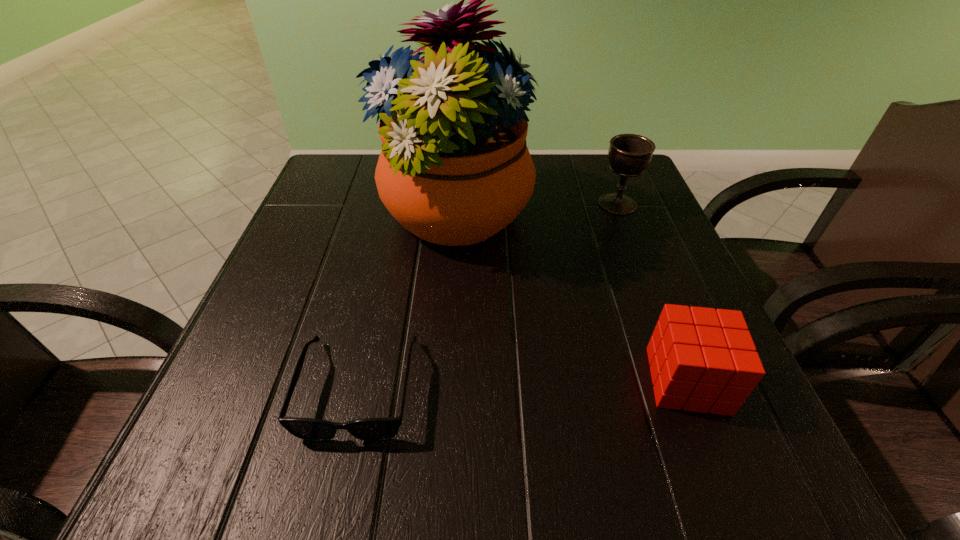
This screenshot has width=960, height=540. In order to click on free area in between the second shortest object and the chalice in this screenshot , I will do `click(652, 292)`.

Identify the location of vacant area that lies between the tallest object and the shortest object. (407, 303).

Where is `vacant area that lies between the third shortest object and the sunglasses`? The image size is (960, 540). vacant area that lies between the third shortest object and the sunglasses is located at coordinates (488, 296).

Locate an element on the screen. object that stands as the closest to the third shortest object is located at coordinates (454, 169).

The height and width of the screenshot is (540, 960). Identify the location of the third closest object to the tallest object. (704, 360).

Where is `vacant space that satisfies the following two spatial constraints: 1. on the back side of the chalice; 2. on the left side of the flower arrangement`? Image resolution: width=960 pixels, height=540 pixels. vacant space that satisfies the following two spatial constraints: 1. on the back side of the chalice; 2. on the left side of the flower arrangement is located at coordinates (456, 204).

At what (x,y) coordinates should I click in order to perform the action: click on free location that satisfies the following two spatial constraints: 1. on the front side of the second shortest object; 2. on the right side of the chalice. Please return your answer as a coordinate pair (x, y). The height and width of the screenshot is (540, 960). Looking at the image, I should click on 686,380.